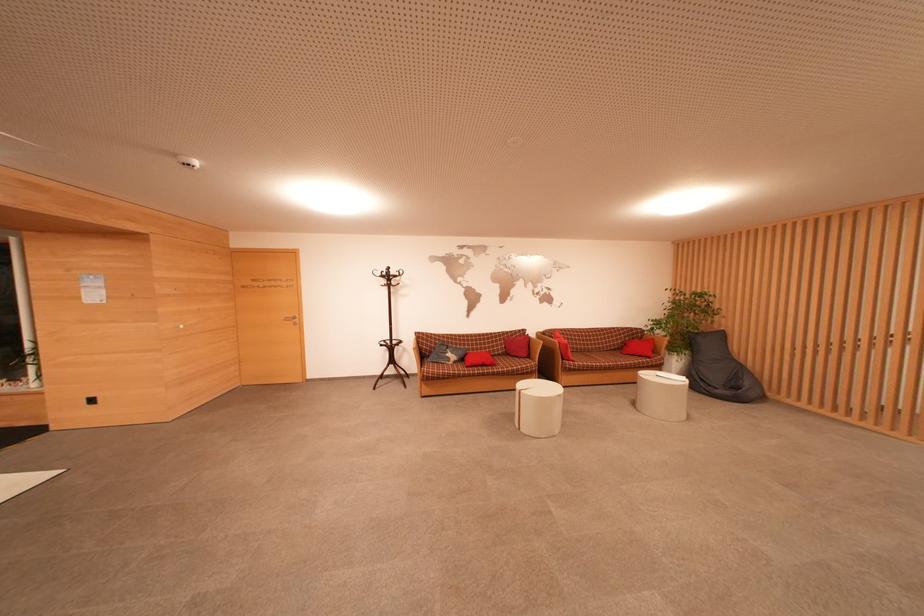
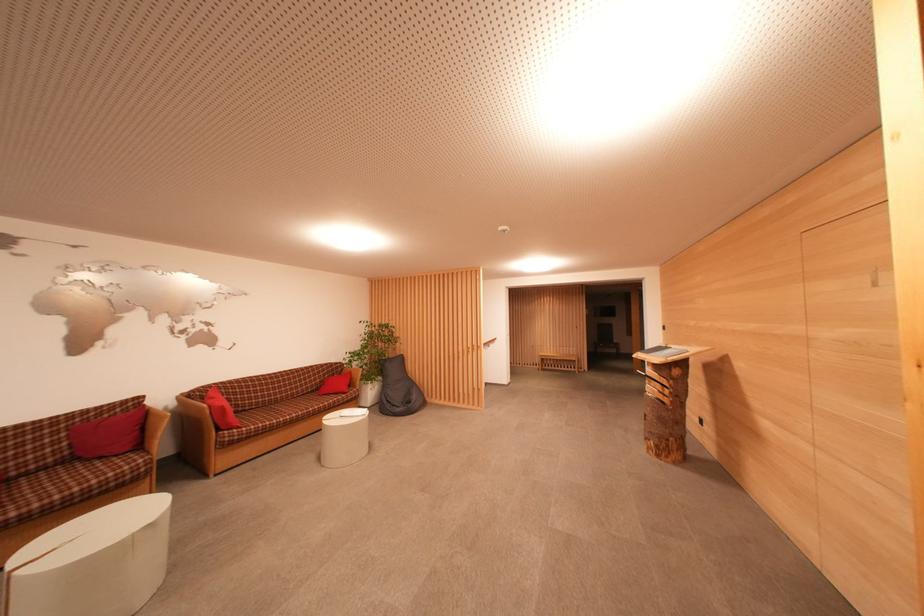
In the second image, find the point that corresponds to point (567, 351) in the first image.

(223, 416)